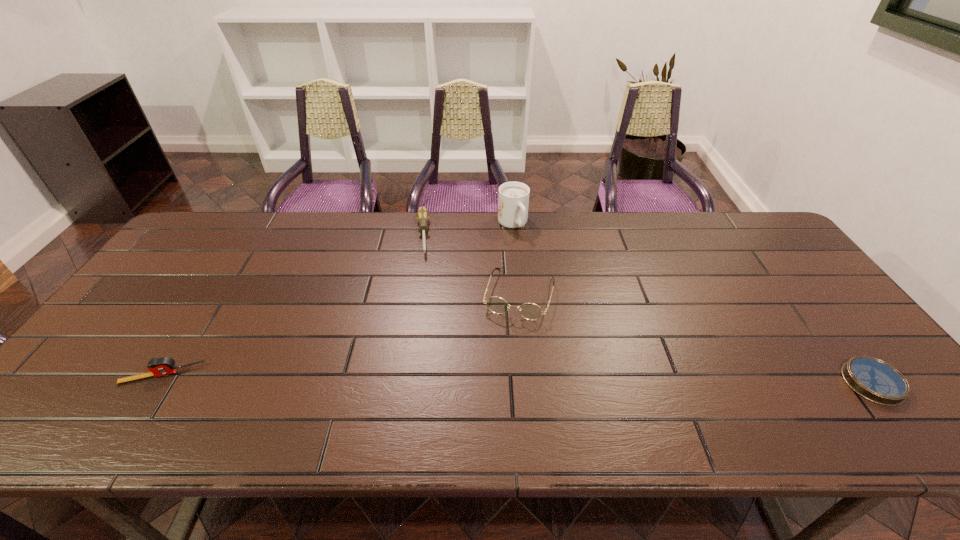
Identify the location of vacant area between the screwdriver and the cappuccino. (468, 229).

Identify the location of empty space between the third nearest object and the rightmost object. This screenshot has width=960, height=540. (696, 339).

At what (x,y) coordinates should I click in order to perform the action: click on vacant point located between the tallest object and the screwdriver. Please return your answer as a coordinate pair (x, y). The image size is (960, 540). Looking at the image, I should click on (468, 229).

I want to click on empty space between the second object from left to right and the tallest object, so click(x=468, y=229).

You are a GUI agent. You are given a task and a screenshot of the screen. Output one action in this format:
    pyautogui.click(x=<x>, y=<y>)
    Task: Click on the unoccupied area between the cappuccino and the fourth shortest object
    
    Given the screenshot: What is the action you would take?
    pyautogui.click(x=516, y=259)

The height and width of the screenshot is (540, 960). What are the coordinates of `vacant region between the second tallest object and the leftmost object` in the screenshot? It's located at (341, 334).

I want to click on free spot between the spectacles and the screwdriver, so pos(470,265).

The width and height of the screenshot is (960, 540). Identify the location of free point between the third nearest object and the leftmost object. (341, 334).

Where is `free area in between the tape measure and the cappuccino`? This screenshot has width=960, height=540. free area in between the tape measure and the cappuccino is located at coordinates pos(338,299).

Find the location of a particular element. free space between the compass and the tallest object is located at coordinates (692, 303).